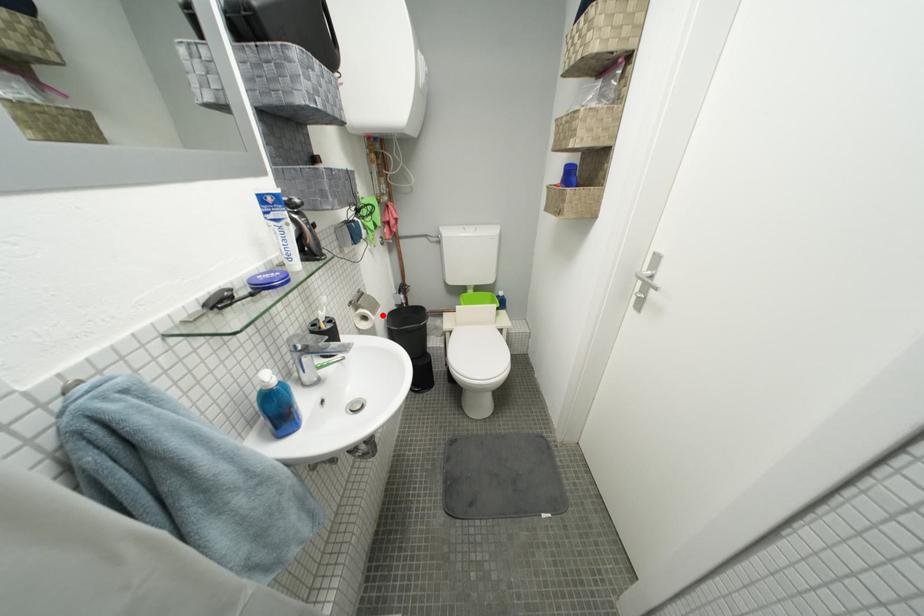
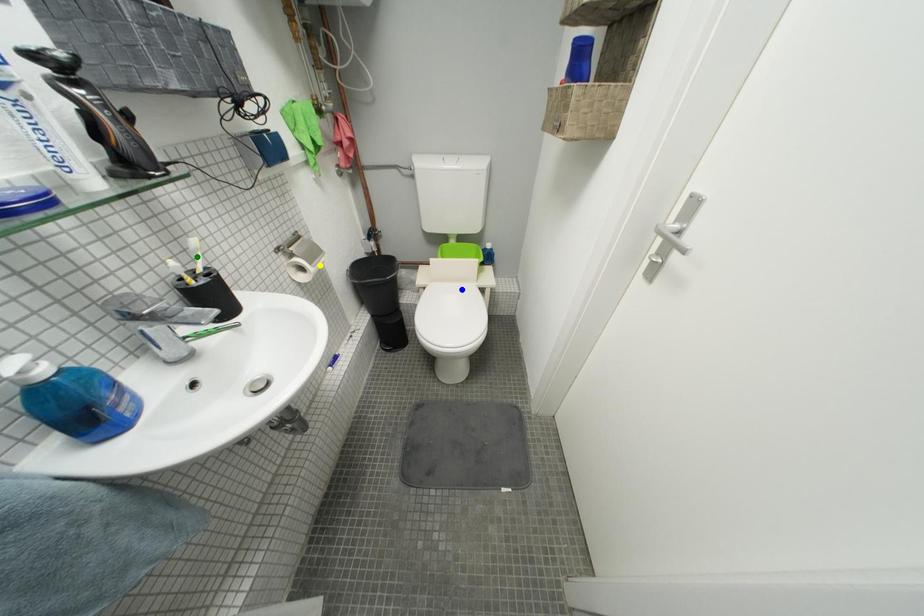
Question: I am providing you with two images of the same scene from different viewpoints. A red point is marked on the first image. You are given multiple points on the second image. Which mark in image 2 goes with the point in image 1?

Choices:
 (A) blue point
 (B) green point
 (C) yellow point

Answer: (C)